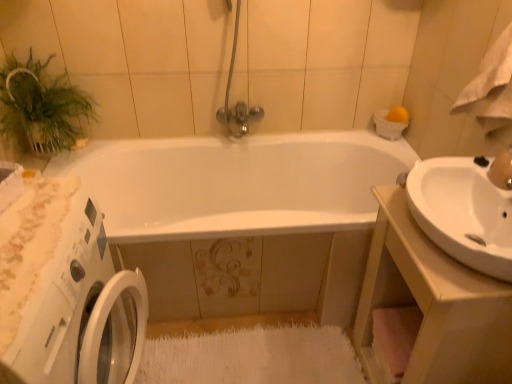
You are a GUI agent. You are given a task and a screenshot of the screen. Output one action in this format:
    pyautogui.click(x=<x>, y=<y>)
    Task: Click on the white glossy sink at right
    
    Given the screenshot: What is the action you would take?
    pos(463,212)

Locate an element on the screen. This screenshot has height=384, width=512. green leafy plant at upper left is located at coordinates (41, 106).

Where is `matte gold faucet at upper right`? The width and height of the screenshot is (512, 384). matte gold faucet at upper right is located at coordinates (502, 170).

Measure the distance between white glossy sink at right and camera.

white glossy sink at right and camera are 37.72 inches apart.

Describe the element at coordinates (428, 308) in the screenshot. The width and height of the screenshot is (512, 384). I see `white glossy sink at right` at that location.

The height and width of the screenshot is (384, 512). Describe the element at coordinates (81, 312) in the screenshot. I see `white glossy washing machine at left` at that location.

The width and height of the screenshot is (512, 384). Find the location of `white soft towel at upper right`. white soft towel at upper right is located at coordinates (490, 87).

I want to click on white glossy sink at right, so click(463, 212).

From a real-world perspective, between matte gold faucet at upper right and white soft towel at upper right, who is vertically higher?

white soft towel at upper right, from a real-world perspective.

What's the angular difference between matte gold faucet at upper right and white soft towel at upper right's facing directions?

0.00294 degrees.

Who is smaller, matte gold faucet at upper right or white soft towel at upper right?

Smaller between the two is matte gold faucet at upper right.

Which is behind, green leafy plant at upper left or white glossy washing machine at left?

green leafy plant at upper left is further away from the camera.

Is white glossy washing machine at left at the back of green leafy plant at upper left?

No, green leafy plant at upper left is not facing the opposite direction of white glossy washing machine at left.

From a real-world perspective, is green leafy plant at upper left positioned over white glossy washing machine at left based on gravity?

Yes, from a real-world perspective, green leafy plant at upper left is on top of white glossy washing machine at left.

How many degrees apart are the facing directions of green leafy plant at upper left and white glossy washing machine at left?

There is a 0.879-degree angle between the facing directions of green leafy plant at upper left and white glossy washing machine at left.

From the image's perspective, is green leafy plant at upper left under matte gold faucet at upper right?

No, from the image's perspective, green leafy plant at upper left is not beneath matte gold faucet at upper right.

The image size is (512, 384). I want to click on faucet above the green leafy plant at upper left (from a real-world perspective), so click(x=502, y=170).

Considering the points (44, 94) and (510, 179), which point is behind, point (44, 94) or point (510, 179)?

Point (44, 94)

Is green leafy plant at upper left facing away from matte gold faucet at upper right?

No, green leafy plant at upper left's orientation is not away from matte gold faucet at upper right.

Locate an element on the screen. This screenshot has height=384, width=512. plant on the left of white glossy sink at right is located at coordinates (41, 106).

Can you confirm if green leafy plant at upper left is bigger than white glossy sink at right?

Yes.

Is green leafy plant at upper left looking in the opposite direction of white glossy sink at right?

No, green leafy plant at upper left is not facing the opposite direction of white glossy sink at right.

What's the angular difference between matte gold faucet at upper right and white glossy washing machine at left's facing directions?

The angle between the facing direction of matte gold faucet at upper right and the facing direction of white glossy washing machine at left is 180 degrees.

Which of these two, matte gold faucet at upper right or white glossy washing machine at left, stands shorter?

With less height is matte gold faucet at upper right.

From a real-world perspective, is matte gold faucet at upper right located beneath white glossy washing machine at left?

No, from a real-world perspective, matte gold faucet at upper right is not beneath white glossy washing machine at left.

From the image's perspective, which object appears higher, matte gold faucet at upper right or white glossy washing machine at left?

matte gold faucet at upper right is shown above in the image.

Considering the sizes of objects white glossy sink at right and green leafy plant at upper left in the image provided, who is shorter, white glossy sink at right or green leafy plant at upper left?

Standing shorter between the two is green leafy plant at upper left.

From the picture: Does white glossy sink at right have a greater width compared to green leafy plant at upper left?

Yes, white glossy sink at right is wider than green leafy plant at upper left.

Which object is further away from the camera, white glossy sink at right or green leafy plant at upper left?

green leafy plant at upper left is further from the camera.

Does white glossy sink at right have a larger size compared to green leafy plant at upper left?

Indeed, white glossy sink at right has a larger size compared to green leafy plant at upper left.

In terms of height, does matte gold faucet at upper right look taller or shorter compared to green leafy plant at upper left?

In the image, matte gold faucet at upper right appears to be shorter than green leafy plant at upper left.

From the image's perspective, is matte gold faucet at upper right below green leafy plant at upper left?

Indeed, from the image's perspective, matte gold faucet at upper right is shown beneath green leafy plant at upper left.

Would you say matte gold faucet at upper right contains green leafy plant at upper left?

No, matte gold faucet at upper right does not contain green leafy plant at upper left.

Is point (504, 189) closer to camera compared to point (30, 115)?

Yes, point (504, 189) is closer to viewer.

What are the coordinates of `faucet below the white soft towel at upper right (from a real-world perspective)` in the screenshot? It's located at (502, 170).

The height and width of the screenshot is (384, 512). I want to click on plant above the white glossy washing machine at left (from the image's perspective), so click(41, 106).

Looking at the image, which one is located further to white soft towel at upper right, white glossy washing machine at left or white glossy sink at right?

Based on the image, white glossy washing machine at left appears to be further to white soft towel at upper right.

Based on their spatial positions, is matte gold faucet at upper right or white glossy sink at right further from white glossy washing machine at left?

Based on the image, matte gold faucet at upper right appears to be further to white glossy washing machine at left.

Estimate the real-world distances between objects in this image. Which object is further from matte gold faucet at upper right, white soft towel at upper right or white glossy sink at right?

The object further to matte gold faucet at upper right is white soft towel at upper right.

Based on their spatial positions, is white glossy sink at right or white glossy sink at right closer to white glossy washing machine at left?

Based on the image, white glossy sink at right appears to be nearer to white glossy washing machine at left.

Looking at the image, which one is located closer to green leafy plant at upper left, white soft towel at upper right or white glossy washing machine at left?

white glossy washing machine at left is positioned closer to the anchor green leafy plant at upper left.

Which object lies nearer to the anchor point white soft towel at upper right, green leafy plant at upper left or white glossy sink at right?

Among the two, white glossy sink at right is located nearer to white soft towel at upper right.

Based on their spatial positions, is white soft towel at upper right or green leafy plant at upper left closer to white glossy sink at right?

Among the two, white soft towel at upper right is located nearer to white glossy sink at right.

Looking at the image, which one is located further to white glossy sink at right, green leafy plant at upper left or matte gold faucet at upper right?

The object further to white glossy sink at right is green leafy plant at upper left.

Locate an element on the screen. This screenshot has height=384, width=512. bath towel between white glossy washing machine at left and matte gold faucet at upper right from left to right is located at coordinates (490, 87).

At what (x,y) coordinates should I click in order to perform the action: click on washing machine between green leafy plant at upper left and white glossy sink at right from left to right. Please return your answer as a coordinate pair (x, y). The height and width of the screenshot is (384, 512). Looking at the image, I should click on (81, 312).

Where is `sink situated between green leafy plant at upper left and matte gold faucet at upper right from left to right`? sink situated between green leafy plant at upper left and matte gold faucet at upper right from left to right is located at coordinates (463, 212).

Locate an element on the screen. The height and width of the screenshot is (384, 512). counter top situated between white glossy washing machine at left and white glossy sink at right from left to right is located at coordinates (428, 308).